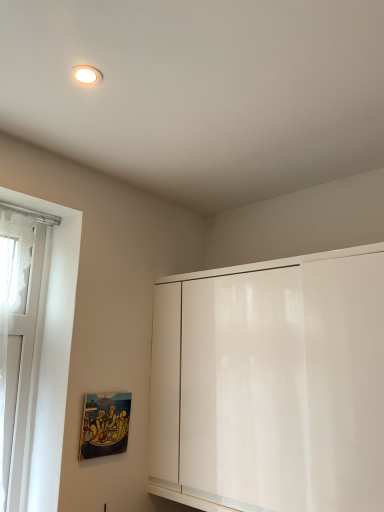
Question: In terms of size, does white glossy cabinet at center appear bigger or smaller than matte wooden picture frame at lower left?

Choices:
 (A) small
 (B) big

Answer: (B)

Question: From a real-world perspective, relative to matte wooden picture frame at lower left, is white glossy cabinet at center vertically above or below?

Choices:
 (A) below
 (B) above

Answer: (B)

Question: Considering the real-world distances, which object is farthest from the white glossy cabinet at center?

Choices:
 (A) matte wooden picture frame at lower left
 (B) white glass window at left

Answer: (B)

Question: Estimate the real-world distances between objects in this image. Which object is closer to the white glossy cabinet at center?

Choices:
 (A) white glass window at left
 (B) matte wooden picture frame at lower left

Answer: (B)